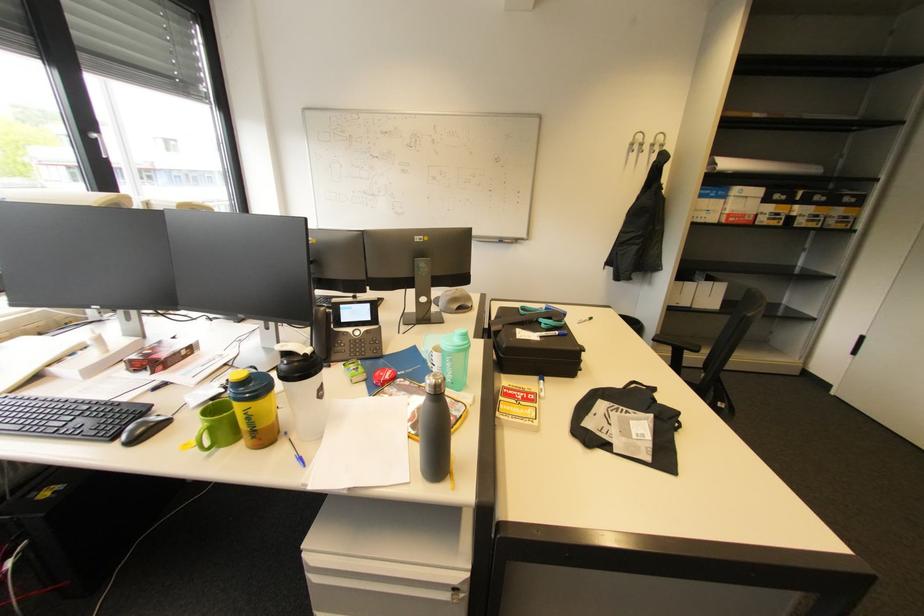
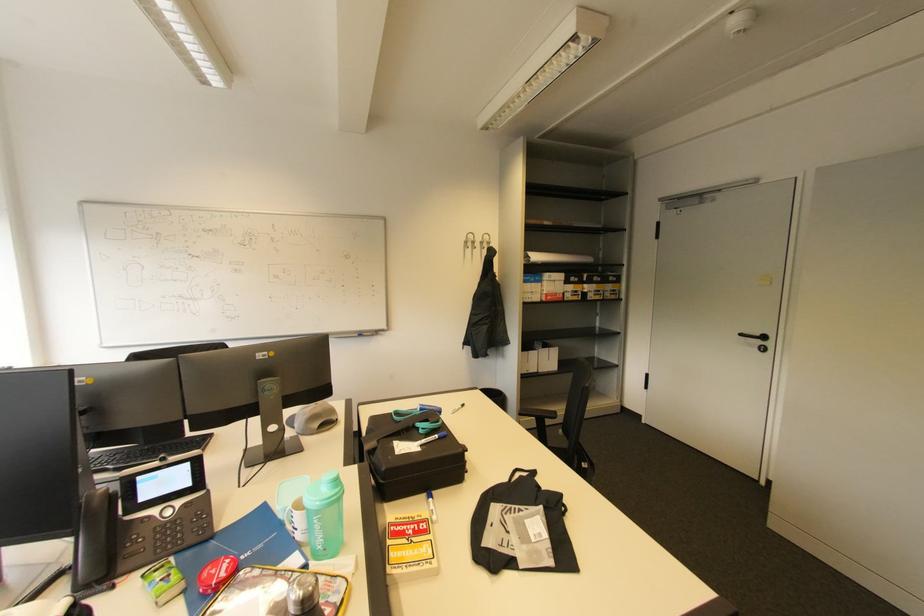
Find the pixel in the second image that matches the point at 369,383 in the first image.

(187, 597)